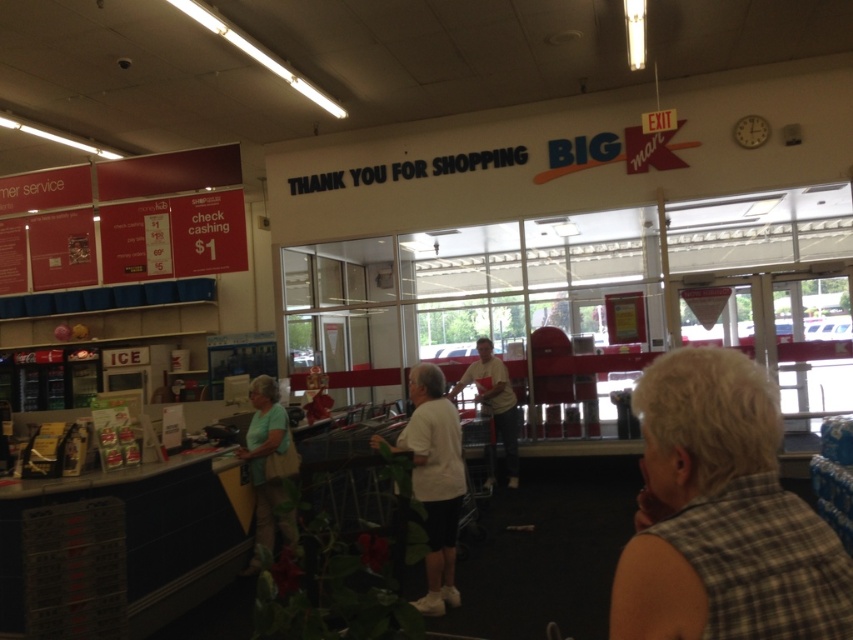
Question: Among these objects, which one is farthest from the camera?

Choices:
 (A) white matte shirt at center
 (B) white cotton shirt at center
 (C) light green fabric shirt at center

Answer: (B)

Question: Among these objects, which one is nearest to the camera?

Choices:
 (A) white matte shirt at center
 (B) light green fabric shirt at center
 (C) white cotton shirt at center

Answer: (A)

Question: From the image, what is the correct spatial relationship of brown plaid shirt at lower right in relation to white matte shirt at center?

Choices:
 (A) above
 (B) below

Answer: (A)

Question: Is light green fabric shirt at center to the left of white cotton shirt at center from the viewer's perspective?

Choices:
 (A) no
 (B) yes

Answer: (B)

Question: Considering the real-world distances, which object is farthest from the light green fabric shirt at center?

Choices:
 (A) brown plaid shirt at lower right
 (B) white matte shirt at center

Answer: (A)

Question: Does light green fabric shirt at center appear on the right side of white cotton shirt at center?

Choices:
 (A) yes
 (B) no

Answer: (B)